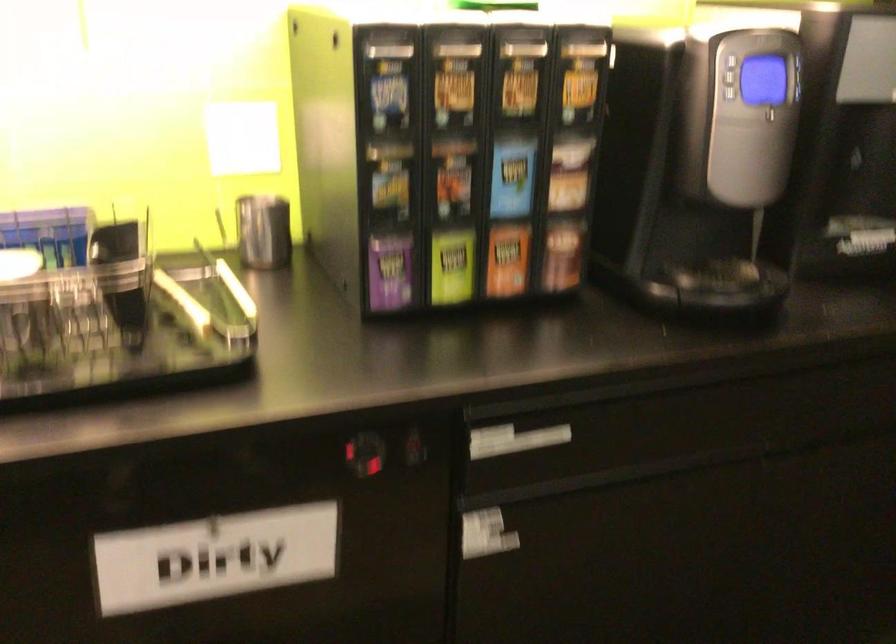
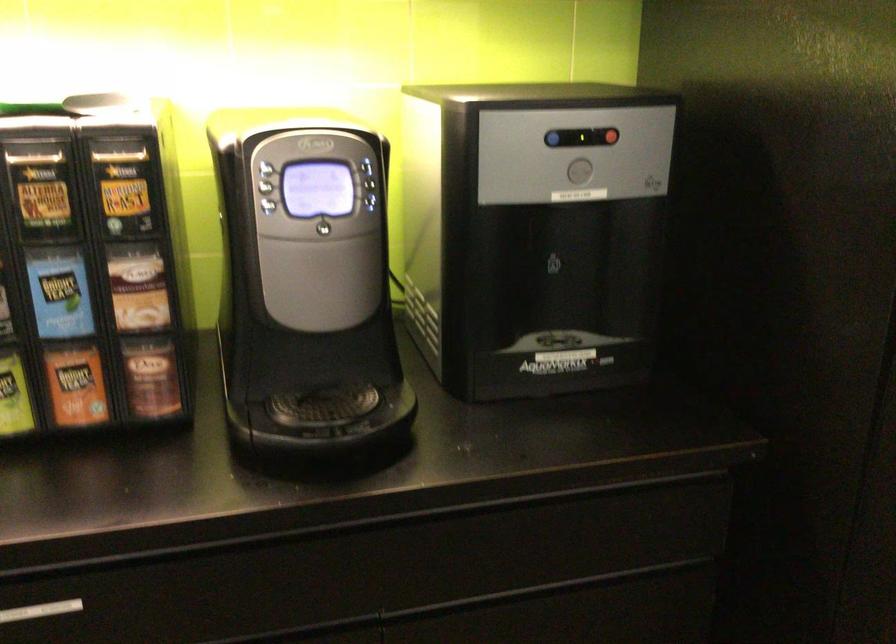
Where in the second image is the point corresponding to the point at 512,174 from the first image?

(58, 292)